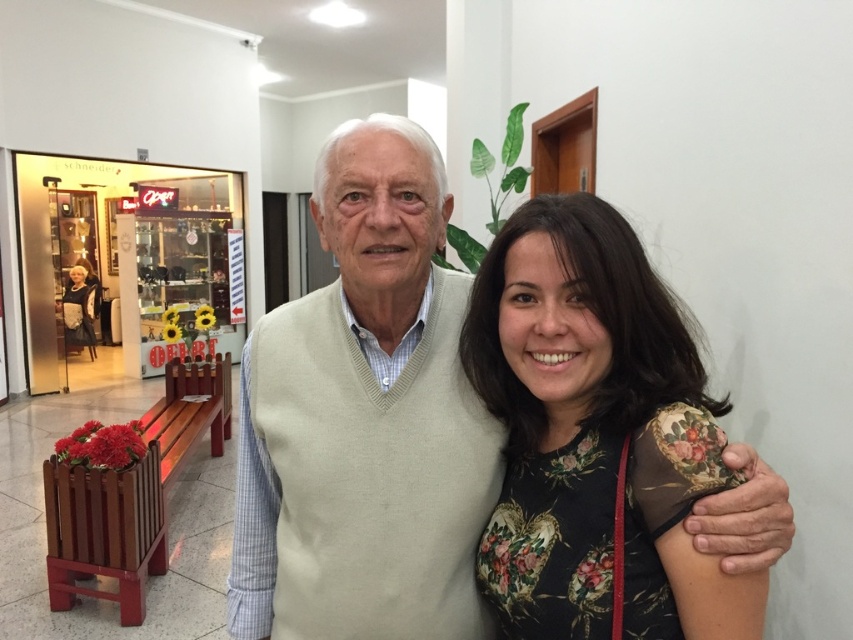
Question: Which object is the closest to the light beige sweater at center?

Choices:
 (A) black textured coat at left
 (B) floral fabric dress at center

Answer: (B)

Question: Does light beige sweater at center appear on the left side of floral fabric dress at center?

Choices:
 (A) no
 (B) yes

Answer: (B)

Question: From the image, what is the correct spatial relationship of floral fabric dress at center in relation to black textured coat at left?

Choices:
 (A) below
 (B) above

Answer: (A)

Question: Is light beige sweater at center to the right of floral fabric dress at center from the viewer's perspective?

Choices:
 (A) no
 (B) yes

Answer: (A)

Question: Which point is closer to the camera taking this photo?

Choices:
 (A) (500, 320)
 (B) (78, 289)

Answer: (A)

Question: Among these points, which one is farthest from the camera?

Choices:
 (A) (73, 291)
 (B) (698, 472)

Answer: (A)